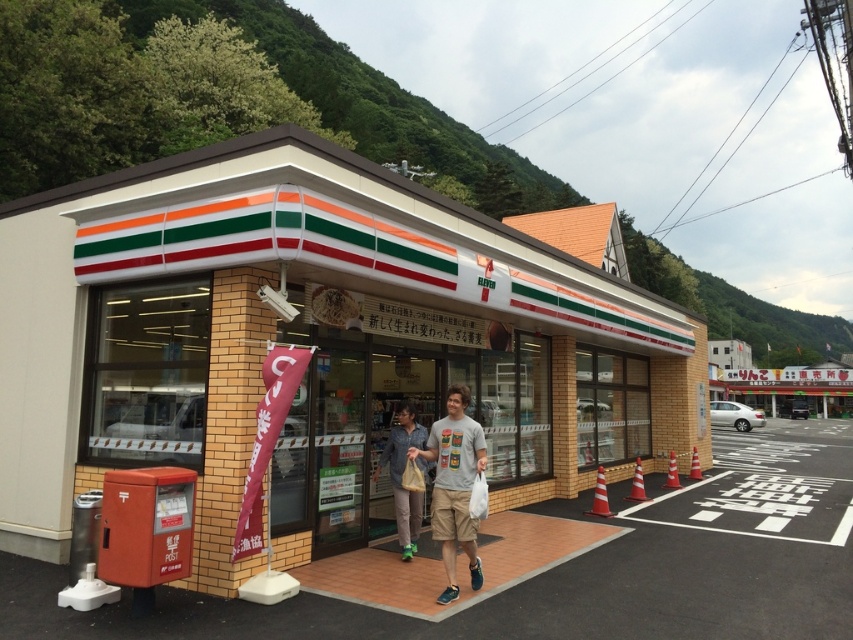
Question: Is the position of brick facade convenience store at center more distant than that of denim shirt at center?

Choices:
 (A) no
 (B) yes

Answer: (A)

Question: Which point is farther from the camera taking this photo?

Choices:
 (A) (399, 477)
 (B) (138, 397)
 (C) (447, 464)

Answer: (A)

Question: Which point is farther to the camera?

Choices:
 (A) gray cotton t-shirt at center
 (B) denim shirt at center
 (C) brick facade convenience store at center

Answer: (B)

Question: Does brick facade convenience store at center have a lesser width compared to denim shirt at center?

Choices:
 (A) yes
 (B) no

Answer: (B)

Question: Is gray cotton t-shirt at center closer to the viewer compared to denim shirt at center?

Choices:
 (A) no
 (B) yes

Answer: (B)

Question: Which of the following is the closest to the observer?

Choices:
 (A) gray cotton t-shirt at center
 (B) brick facade convenience store at center

Answer: (B)